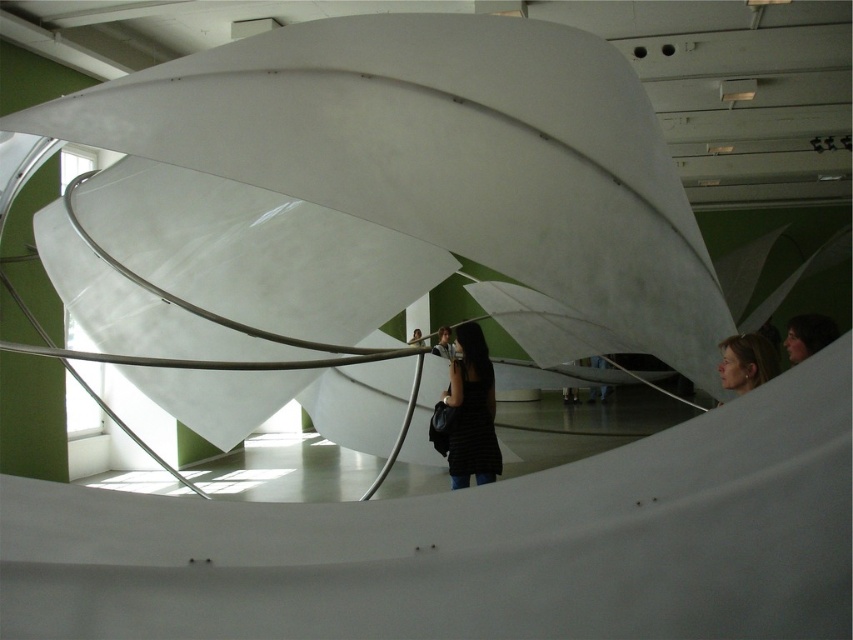
You are a photographer standing in front of the sculpture. You notice the black matte dress at center and the matte black hair at upper right. Which object is positioned lower in the image?

The black matte dress at center is positioned below matte black hair at upper right, so the black matte dress at center is lower in the image.

You are a photographer standing in front of the sculpture. You notice the black matte dress at center and the matte black hair at upper right. Which object is positioned farther away from you?

The matte black hair at upper right is behind the black matte dress at center, so it is farther away from you.